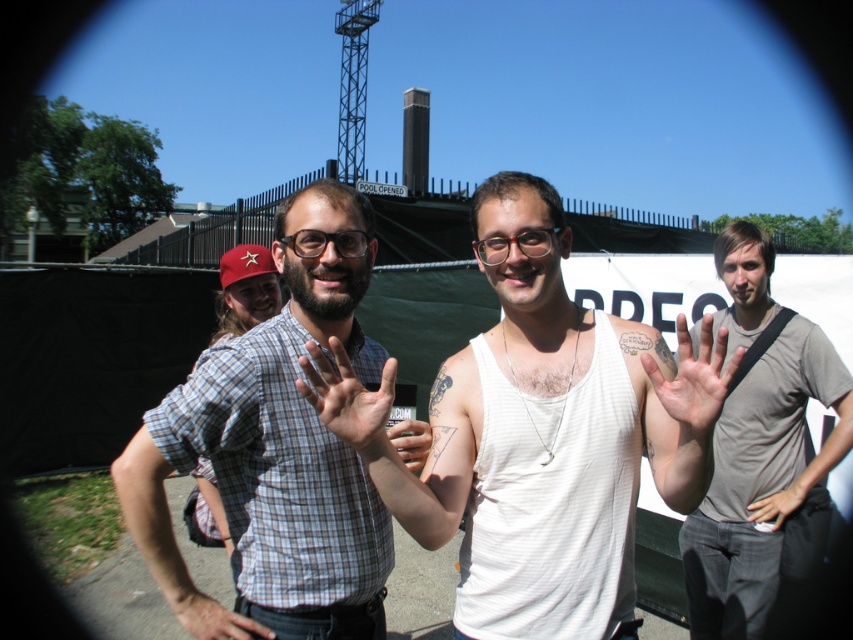
Question: Is gray cotton t-shirt at right positioned behind light skin flesh at center?

Choices:
 (A) no
 (B) yes

Answer: (A)

Question: Can you confirm if checkered fabric shirt at center is thinner than gray cotton t-shirt at right?

Choices:
 (A) no
 (B) yes

Answer: (B)

Question: Can you confirm if white tank top at center is positioned to the right of checkered fabric shirt at center?

Choices:
 (A) yes
 (B) no

Answer: (A)

Question: Among these points, which one is farthest from the camera?

Choices:
 (A) (338, 422)
 (B) (805, 484)
 (C) (318, 250)

Answer: (B)

Question: Among these points, which one is nearest to the camera?

Choices:
 (A) (402, 429)
 (B) (293, 301)

Answer: (A)

Question: Which is farther from the light skin flesh at center?

Choices:
 (A) smooth skin hand at center
 (B) light skin hand at center
 (C) translucent orange glasses at center
 (D) matte skin hand at center

Answer: (A)